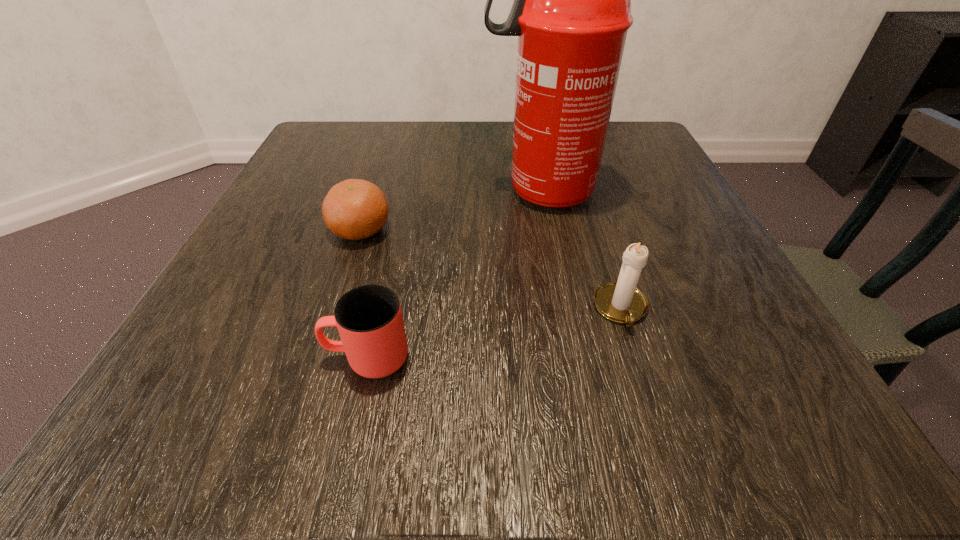
Locate an element on the screen. the tallest object is located at coordinates (571, 12).

At what (x,y) coordinates should I click in order to perform the action: click on the third shortest object. Please return your answer as a coordinate pair (x, y). The image size is (960, 540). Looking at the image, I should click on (621, 301).

The height and width of the screenshot is (540, 960). Find the location of `the third farthest object`. the third farthest object is located at coordinates (621, 301).

I want to click on cup, so click(x=369, y=319).

The width and height of the screenshot is (960, 540). I want to click on clementine, so click(354, 209).

Where is `vacant space situated 0.130m on the trigger side of the tallest object`? The width and height of the screenshot is (960, 540). vacant space situated 0.130m on the trigger side of the tallest object is located at coordinates (414, 191).

You are a GUI agent. You are given a task and a screenshot of the screen. Output one action in this format:
    pyautogui.click(x=<x>, y=<y>)
    Task: Click on the vacant space located 0.180m on the trigger side of the tallest object
    The width and height of the screenshot is (960, 540).
    Given the screenshot: What is the action you would take?
    pyautogui.click(x=387, y=191)

Identify the location of free space located 0.110m on the trigger side of the tallest object. The height and width of the screenshot is (540, 960). [424, 191].

This screenshot has height=540, width=960. I want to click on free space located 0.130m on the handle side of the candle holder, so click(658, 427).

I want to click on free space located on the right of the clementine, so click(571, 230).